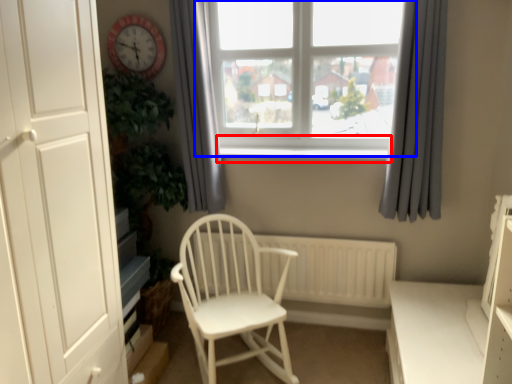
Question: Among these objects, which one is farthest to the camera, window sill (highlighted by a red box) or window (highlighted by a blue box)?

Choices:
 (A) window sill
 (B) window

Answer: (A)